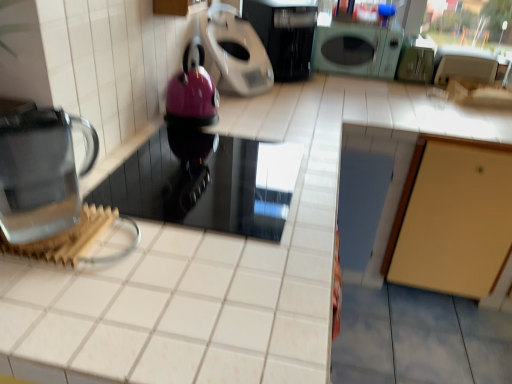
Question: Considering the relative sizes of black glossy microwave at upper center, arranged as the second kitchen appliance when viewed from the left, and transparent glass kettle at left in the image provided, is black glossy microwave at upper center, arranged as the second kitchen appliance when viewed from the left, shorter than transparent glass kettle at left?

Choices:
 (A) no
 (B) yes

Answer: (A)

Question: Is black glossy microwave at upper center, which is the 1th kitchen appliance in right-to-left order, not inside transparent glass kettle at left?

Choices:
 (A) no
 (B) yes

Answer: (B)

Question: Considering the relative sizes of black glossy microwave at upper center, arranged as the second kitchen appliance when viewed from the left, and transparent glass kettle at left in the image provided, is black glossy microwave at upper center, arranged as the second kitchen appliance when viewed from the left, wider than transparent glass kettle at left?

Choices:
 (A) no
 (B) yes

Answer: (B)

Question: Can you confirm if black glossy microwave at upper center, which is the 1th kitchen appliance in right-to-left order, is positioned to the left of transparent glass kettle at left?

Choices:
 (A) no
 (B) yes

Answer: (A)

Question: Is black glossy microwave at upper center, arranged as the second kitchen appliance when viewed from the left, positioned with its back to transparent glass kettle at left?

Choices:
 (A) no
 (B) yes

Answer: (A)

Question: From a real-world perspective, is glossy black microwave at center, the first appliance positioned from the bottom, physically located above or below black glossy microwave at upper center, arranged as the second kitchen appliance when viewed from the left?

Choices:
 (A) above
 (B) below

Answer: (B)

Question: From the image's perspective, is glossy black microwave at center, acting as the second appliance starting from the top, above or below black glossy microwave at upper center, which is the 1th kitchen appliance in right-to-left order?

Choices:
 (A) below
 (B) above

Answer: (A)

Question: Visually, is glossy black microwave at center, the first appliance positioned from the bottom, positioned to the left or to the right of black glossy microwave at upper center, which is the 1th kitchen appliance in right-to-left order?

Choices:
 (A) right
 (B) left

Answer: (B)

Question: Based on their sizes in the image, would you say glossy black microwave at center, the first appliance positioned from the bottom, is bigger or smaller than black glossy microwave at upper center, which is the 1th kitchen appliance in right-to-left order?

Choices:
 (A) big
 (B) small

Answer: (B)

Question: Is point (64, 193) closer or farther from the camera than point (184, 99)?

Choices:
 (A) closer
 (B) farther

Answer: (A)

Question: Visually, is transparent glass kettle at left positioned to the left or to the right of glossy plastic kettle at upper center, positioned as the 1th appliance in top-to-bottom order?

Choices:
 (A) right
 (B) left

Answer: (B)

Question: Looking at the image, does transparent glass kettle at left seem bigger or smaller compared to glossy plastic kettle at upper center, the second appliance when ordered from bottom to top?

Choices:
 (A) small
 (B) big

Answer: (A)

Question: Is transparent glass kettle at left taller or shorter than glossy plastic kettle at upper center, positioned as the 1th appliance in top-to-bottom order?

Choices:
 (A) short
 (B) tall

Answer: (A)

Question: Based on their sizes in the image, would you say metallic silver scale at upper center, which is counted as the second kitchen appliance, starting from the right, is bigger or smaller than transparent glass kettle at left?

Choices:
 (A) small
 (B) big

Answer: (B)

Question: From the image's perspective, is metallic silver scale at upper center, which is counted as the second kitchen appliance, starting from the right, above or below transparent glass kettle at left?

Choices:
 (A) below
 (B) above

Answer: (B)